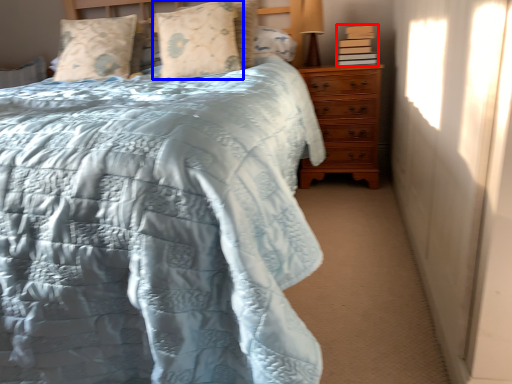
Question: Which object appears closest to the camera in this image, book (highlighted by a red box) or pillow (highlighted by a blue box)?

Choices:
 (A) book
 (B) pillow

Answer: (B)